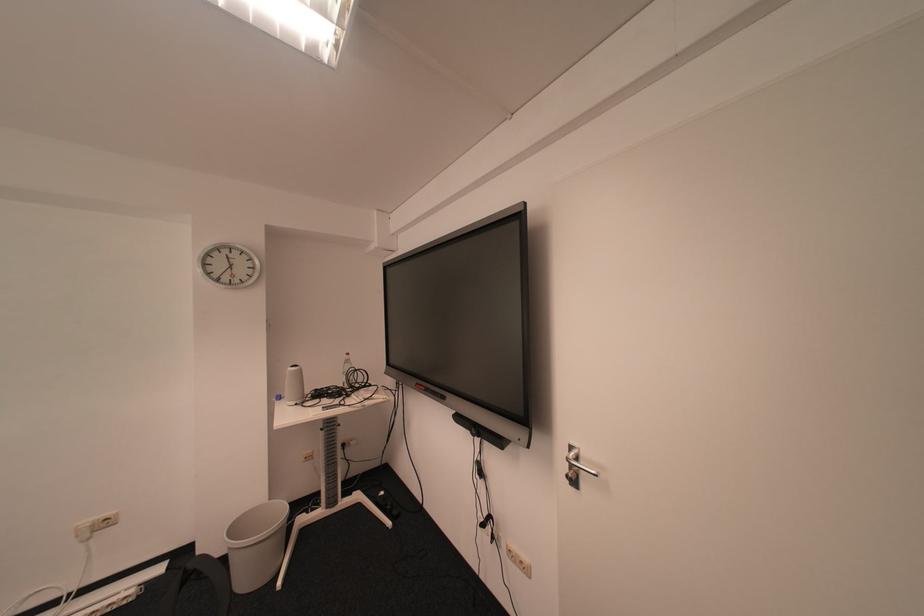
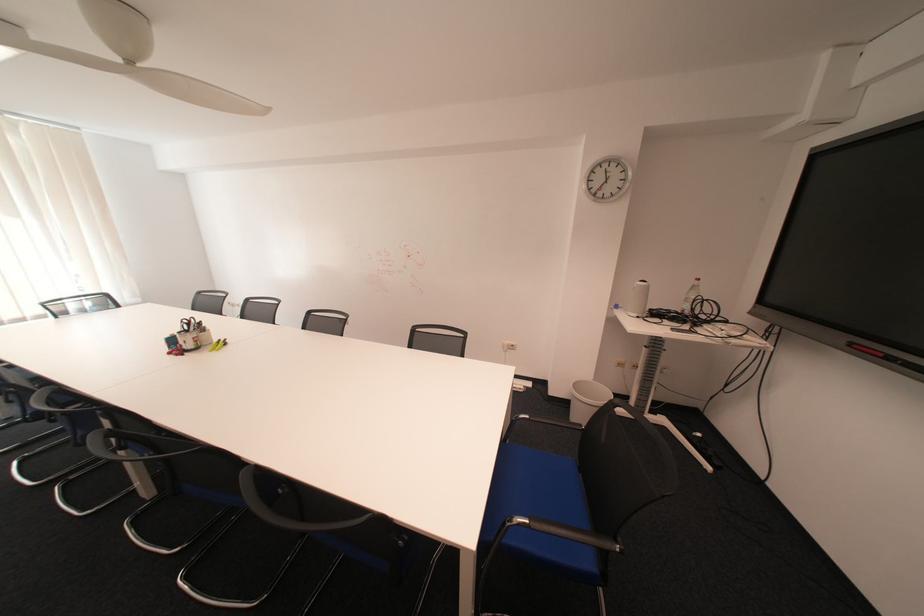
How did the camera likely rotate?

The camera rotated toward left-down.